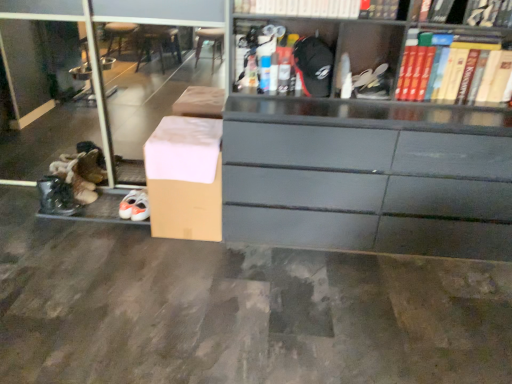
Question: Looking at the image, does brown cardboard box at lower left seem bigger or smaller compared to hardcover book at upper right, which is counted as the fourth book, starting from the left?

Choices:
 (A) small
 (B) big

Answer: (B)

Question: Is brown cardboard box at lower left inside the boundaries of hardcover book at upper right, the first book from the right, or outside?

Choices:
 (A) outside
 (B) inside

Answer: (A)

Question: Based on their relative distances, which object is nearer to the hardcover book at upper right, which is counted as the fourth book, starting from the left?

Choices:
 (A) hardcover book at upper center, which is the fourth book from right to left
 (B) white matte shoe at upper center
 (C) brown cardboard box at lower left
 (D) brown cardboard box at lower left
 (E) hardcover book at upper center, placed as the 2th book when sorted from left to right

Answer: (E)

Question: Based on their relative distances, which object is farther from the white matte shoe at upper center?

Choices:
 (A) brown cardboard box at lower left
 (B) brown cardboard box at lower left
 (C) hardcover book at upper right, marked as the third book in a left-to-right arrangement
 (D) hardcover book at upper center, which is the 3th book from right to left
 (E) hardcover book at upper center, which is the fourth book from right to left

Answer: (B)